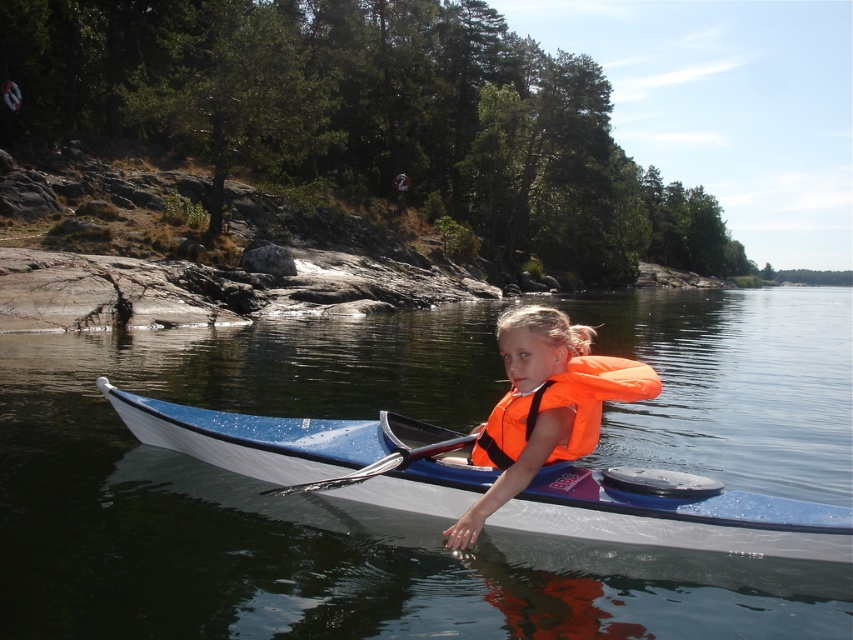
Question: Among these objects, which one is farthest from the camera?

Choices:
 (A) blue glossy kayak at center
 (B) transparent blue water at center
 (C) orange life vest at center
 (D) orange fabric life jacket at center

Answer: (B)

Question: Which object is closer to the camera taking this photo?

Choices:
 (A) transparent blue water at center
 (B) orange life vest at center
 (C) orange fabric life jacket at center
 (D) blue glossy kayak at center

Answer: (C)

Question: Can you confirm if blue glossy kayak at center is bigger than orange fabric life jacket at center?

Choices:
 (A) yes
 (B) no

Answer: (A)

Question: Is blue glossy kayak at center closer to the viewer compared to orange life vest at center?

Choices:
 (A) yes
 (B) no

Answer: (B)

Question: Can you confirm if transparent blue water at center is positioned below orange fabric life jacket at center?

Choices:
 (A) no
 (B) yes

Answer: (A)

Question: Among these points, which one is farthest from the camera?

Choices:
 (A) (277, 422)
 (B) (490, 461)

Answer: (A)